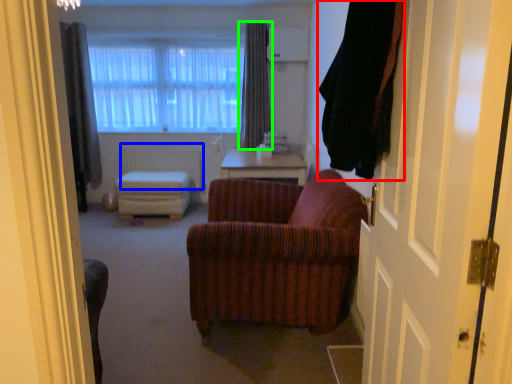
Question: Which object is positioned closest to curtain (highlighted by a red box)? Select from radiator (highlighted by a blue box) and curtain (highlighted by a green box).

Choices:
 (A) radiator
 (B) curtain

Answer: (B)